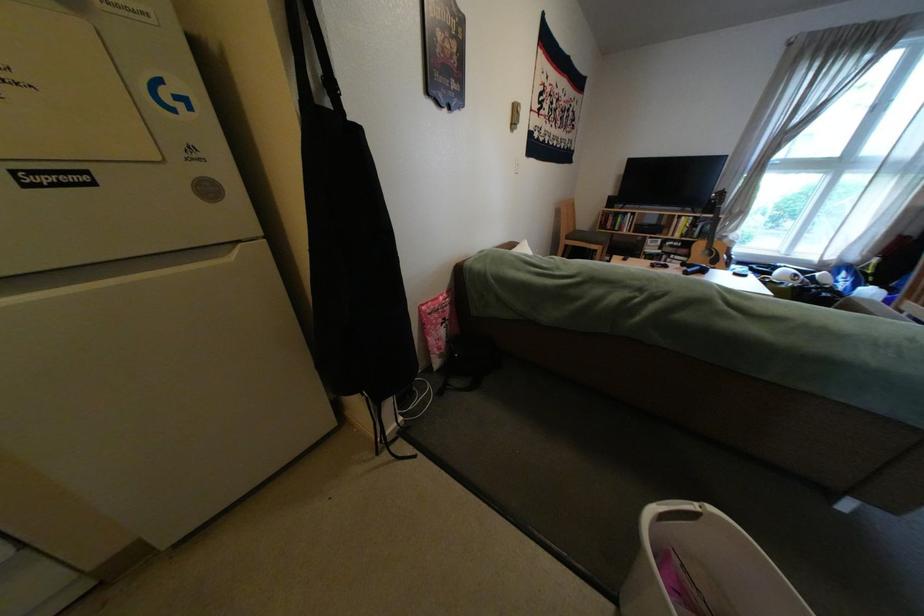
What do you see at coordinates (125, 264) in the screenshot? This screenshot has width=924, height=616. I see `a refrigerator door handle` at bounding box center [125, 264].